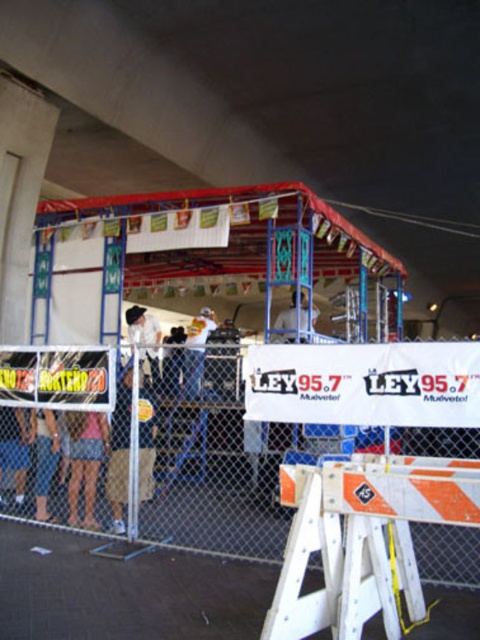
Question: Among these objects, which one is farthest from the camera?

Choices:
 (A) tan fabric pants at center
 (B) chain link fence at lower left
 (C) pink fabric shorts at lower center
 (D) white plastic barricade at lower center

Answer: (B)

Question: Estimate the real-world distances between objects in this image. Which object is farther from the white fabric at center?

Choices:
 (A) pink fabric shorts at lower center
 (B) tan fabric pants at center

Answer: (A)

Question: Does white plastic barricade at lower center lie behind white fabric at center?

Choices:
 (A) no
 (B) yes

Answer: (A)

Question: Can you confirm if chain link fence at lower left is thinner than white fabric at center?

Choices:
 (A) yes
 (B) no

Answer: (B)

Question: Is white plastic barricade at lower center in front of tan fabric pants at center?

Choices:
 (A) no
 (B) yes

Answer: (B)

Question: Which object is closer to the camera taking this photo?

Choices:
 (A) chain link fence at lower left
 (B) white fabric at center

Answer: (A)